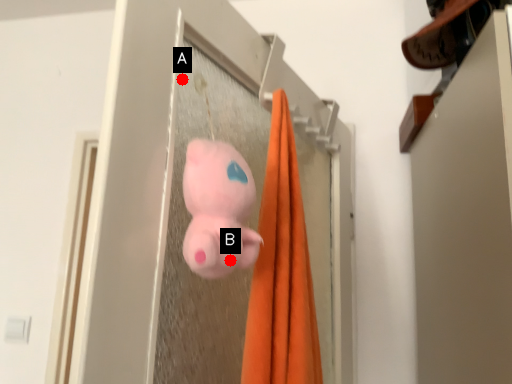
Question: Two points are circled on the image, labeled by A and B beside each circle. Which point is farther from the camera taking this photo?

Choices:
 (A) A is further
 (B) B is further

Answer: (A)